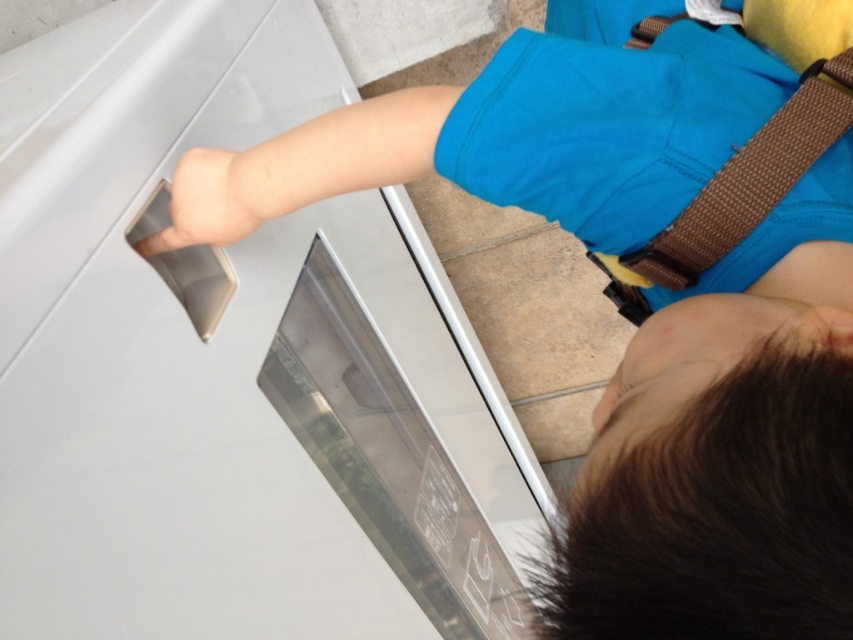
Based on the photo, you are a home safety inspector checking the kitchen. You notice the white glossy dishwasher at upper left and the brown woven strap at upper right. Which object is wider?

The white glossy dishwasher at upper left is wider than the brown woven strap at upper right according to the description.

You are a parent trying to load dishes into the dishwasher. You see the white glossy dishwasher at upper left and the skinny beige handle at left. Which one is taller?

The white glossy dishwasher at upper left is taller than the skinny beige handle at left.

You are a parent trying to load dishes into the dishwasher. The white glossy dishwasher at upper left is located at point 0.570, 0.273. Can you determine if the dishwasher is positioned to the left or right of the child?

The white glossy dishwasher at upper left is located at point (231,364), which means it is positioned to the left of the child.